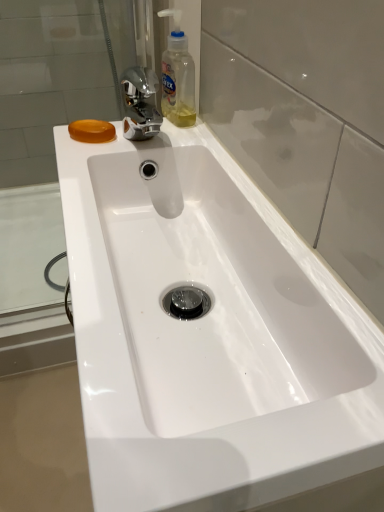
Question: Considering the relative positions of translucent plastic bottle at upper center and transparent glass door at center in the image provided, is translucent plastic bottle at upper center to the left or to the right of transparent glass door at center?

Choices:
 (A) right
 (B) left

Answer: (B)

Question: Relative to transparent glass door at center, is translucent plastic bottle at upper center in front or behind?

Choices:
 (A) behind
 (B) front

Answer: (A)

Question: Based on their relative distances, which object is farther from the orange translucent soap at upper left?

Choices:
 (A) transparent glass door at center
 (B) translucent plastic bottle at upper center

Answer: (A)

Question: Based on their relative distances, which object is nearer to the translucent plastic bottle at upper center?

Choices:
 (A) orange translucent soap at upper left
 (B) transparent glass door at center

Answer: (A)